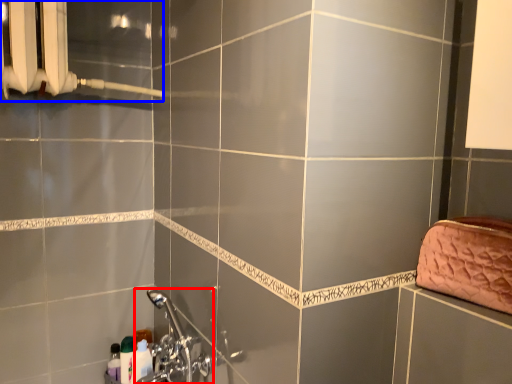
Question: Among these objects, which one is nearest to the camera, plumbing fixture (highlighted by a red box) or shower (highlighted by a blue box)?

Choices:
 (A) plumbing fixture
 (B) shower

Answer: (B)